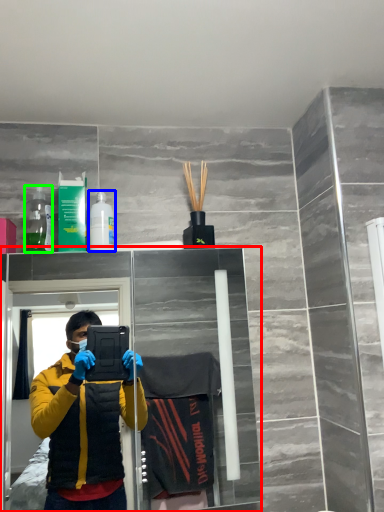
Question: Which object is positioned farthest from glass door (highlighted by a red box)? Select from toiletry (highlighted by a blue box) and bottle (highlighted by a green box).

Choices:
 (A) toiletry
 (B) bottle

Answer: (B)